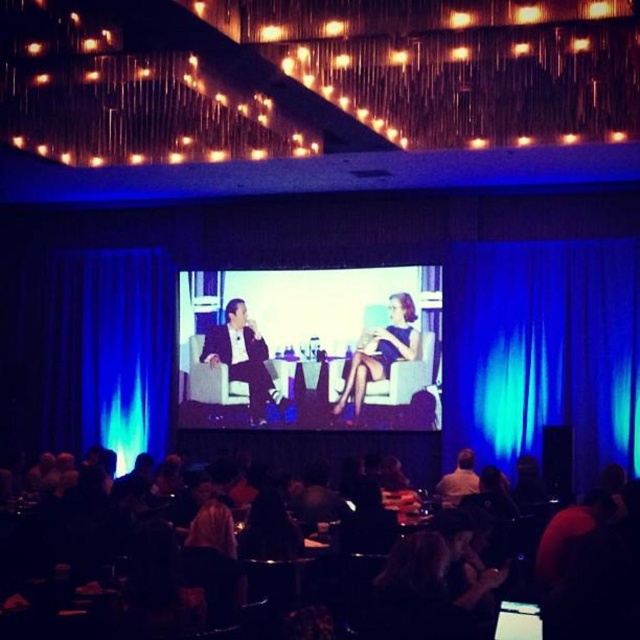
Question: Is blue velvet curtain at left further to the viewer compared to light brown leather jacket at center?

Choices:
 (A) yes
 (B) no

Answer: (A)

Question: Among these objects, which one is farthest from the camera?

Choices:
 (A) satin black suit at center
 (B) blue fabric dress at center
 (C) blue fabric curtain at right
 (D) light brown leather jacket at center

Answer: (A)

Question: Which object is the closest to the satin black suit at center?

Choices:
 (A) light brown leather jacket at center
 (B) blue fabric dress at center
 (C) blue fabric curtain at right

Answer: (B)

Question: Is blue fabric dress at center below light brown leather jacket at center?

Choices:
 (A) yes
 (B) no

Answer: (B)

Question: Which of these objects is positioned closest to the blue fabric curtain at right?

Choices:
 (A) blue velvet curtain at left
 (B) blue fabric dress at center
 (C) light brown leather jacket at center

Answer: (B)

Question: Can you confirm if blue fabric dress at center is wider than light brown leather jacket at center?

Choices:
 (A) yes
 (B) no

Answer: (A)